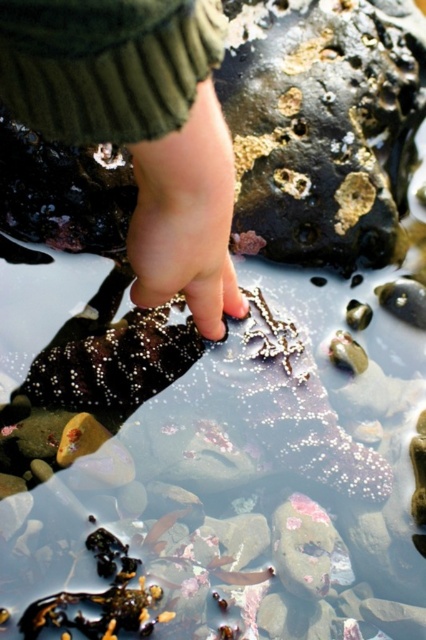
Question: Can you confirm if smooth skin hand at center is positioned to the right of skinny flesh-toned hand at center?

Choices:
 (A) yes
 (B) no

Answer: (A)

Question: Does smooth skin hand at center appear over skinny flesh-toned hand at center?

Choices:
 (A) no
 (B) yes

Answer: (B)

Question: Is smooth skin hand at center positioned at the back of skinny flesh-toned hand at center?

Choices:
 (A) yes
 (B) no

Answer: (B)

Question: Which object appears closest to the camera in this image?

Choices:
 (A) skinny flesh-toned hand at center
 (B) smooth skin hand at center

Answer: (B)

Question: Which point is farther to the camera?

Choices:
 (A) skinny flesh-toned hand at center
 (B) smooth skin hand at center

Answer: (A)

Question: Among these objects, which one is farthest from the camera?

Choices:
 (A) smooth skin hand at center
 (B) skinny flesh-toned hand at center

Answer: (B)